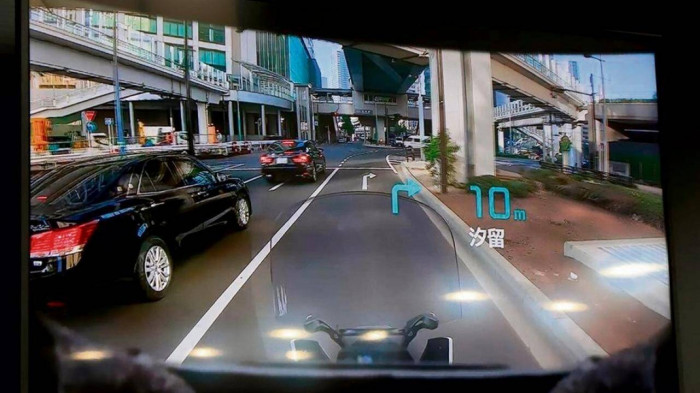
Where is `doors`? The height and width of the screenshot is (393, 700). doors is located at coordinates (175, 218), (214, 201), (316, 158).